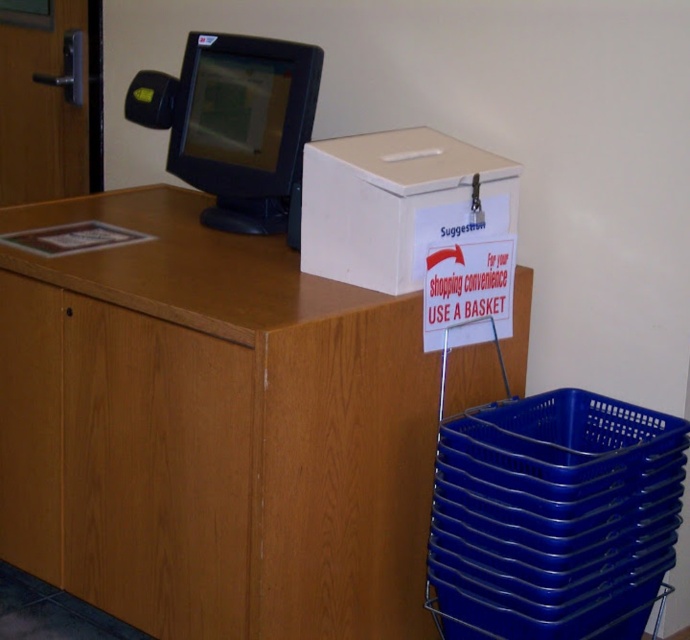
Question: Based on their relative distances, which object is nearer to the white plastic box at upper center?

Choices:
 (A) blue plastic basket at lower right
 (B) matte black monitor at upper center

Answer: (B)

Question: Does blue plastic basket at lower right have a lesser width compared to matte black monitor at upper center?

Choices:
 (A) no
 (B) yes

Answer: (A)

Question: Which is farther from the matte black monitor at upper center?

Choices:
 (A) blue plastic basket at lower right
 (B) wooden table at center

Answer: (A)

Question: From the image, what is the correct spatial relationship of wooden table at center in relation to blue plastic basket at lower right?

Choices:
 (A) above
 (B) below

Answer: (A)

Question: Does white plastic box at upper center appear under matte black monitor at upper center?

Choices:
 (A) yes
 (B) no

Answer: (A)

Question: Among these points, which one is nearest to the camera?

Choices:
 (A) tap(297, 92)
 (B) tap(549, 396)
 (C) tap(324, 264)

Answer: (C)